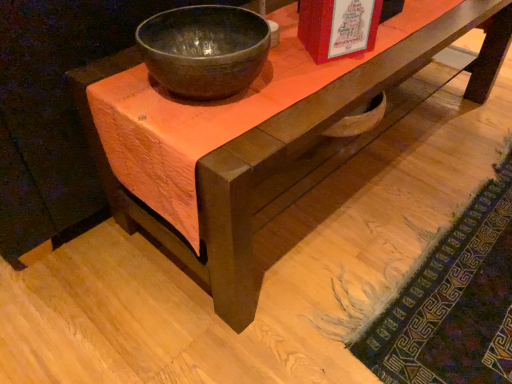
At what (x,y) coordinates should I click in order to perform the action: click on free area behind textured wool mat at lower right. Please return your answer as a coordinate pair (x, y). The height and width of the screenshot is (384, 512). Looking at the image, I should click on (421, 140).